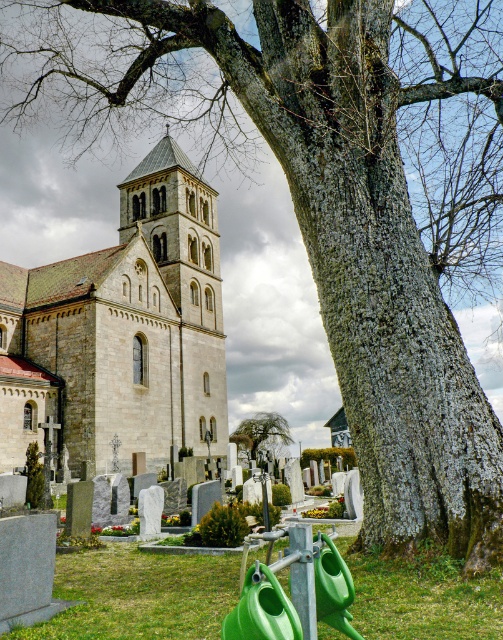
Question: Is stone church at center above green grass at lower center?

Choices:
 (A) no
 (B) yes

Answer: (B)

Question: Which point is closer to the camera taking this photo?

Choices:
 (A) (289, 438)
 (B) (227, 609)

Answer: (B)

Question: Does stone church at center have a lesser width compared to green grass at lower center?

Choices:
 (A) yes
 (B) no

Answer: (B)

Question: Based on their relative distances, which object is nearer to the green grass at lower center?

Choices:
 (A) green leafy tree at center
 (B) stone church at center

Answer: (B)

Question: Which object is closer to the camera taking this photo?

Choices:
 (A) stone church at center
 (B) green grass at lower center

Answer: (B)

Question: Can you confirm if green grass at lower center is smaller than green leafy tree at center?

Choices:
 (A) no
 (B) yes

Answer: (A)